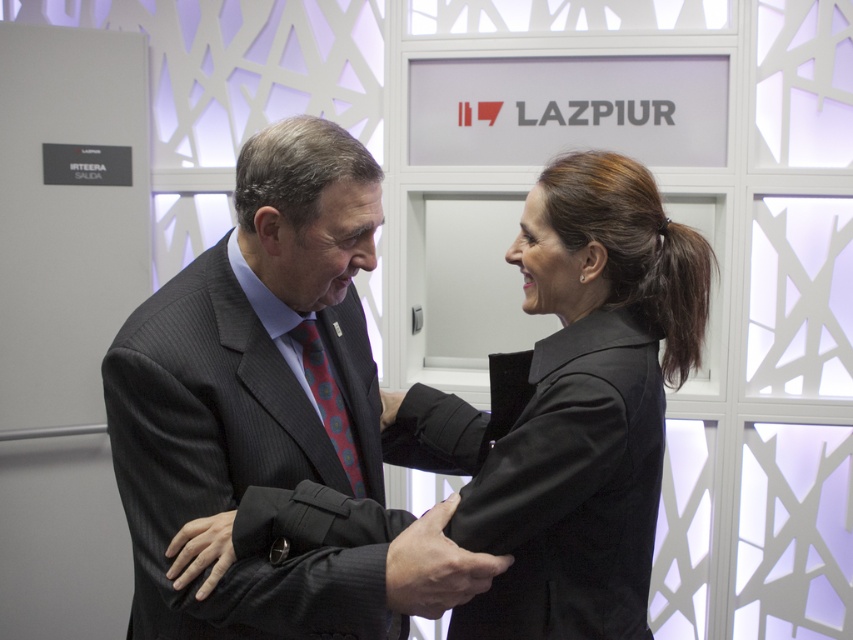
You are standing in the room and want to place a small decoration between the two points, point (561, 572) and point (326, 429). Which point should you place it closer to in order for it to be closer to the viewer?

You should place the decoration closer to point (561, 572) because it is closer to the viewer than point (326, 429).

You are a tailor who needs to determine which garment requires more fabric to make between the dark gray suit at center and the black matte jacket at center. Which one do you choose?

The black matte jacket at center requires more fabric because it is larger than the dark gray suit at center.

What is the exact coordinate of the black matte jacket at center?

The black matte jacket at center is located at point (585, 406).